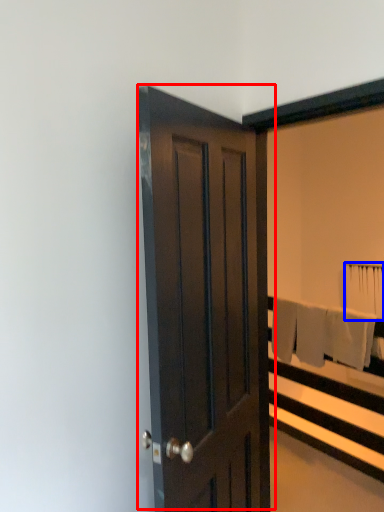
Question: Which object is further to the camera taking this photo, door (highlighted by a red box) or bath towel (highlighted by a blue box)?

Choices:
 (A) door
 (B) bath towel

Answer: (B)